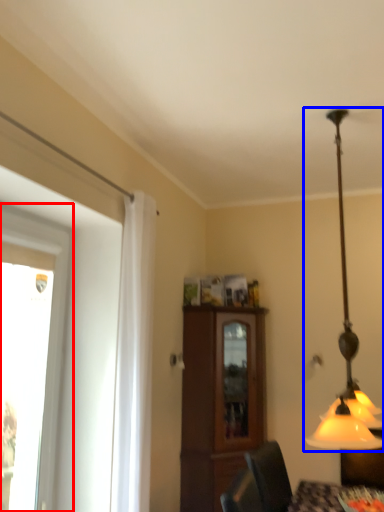
Question: Which of the following is the farthest to the observer, window (highlighted by a red box) or lamp (highlighted by a blue box)?

Choices:
 (A) window
 (B) lamp

Answer: (A)